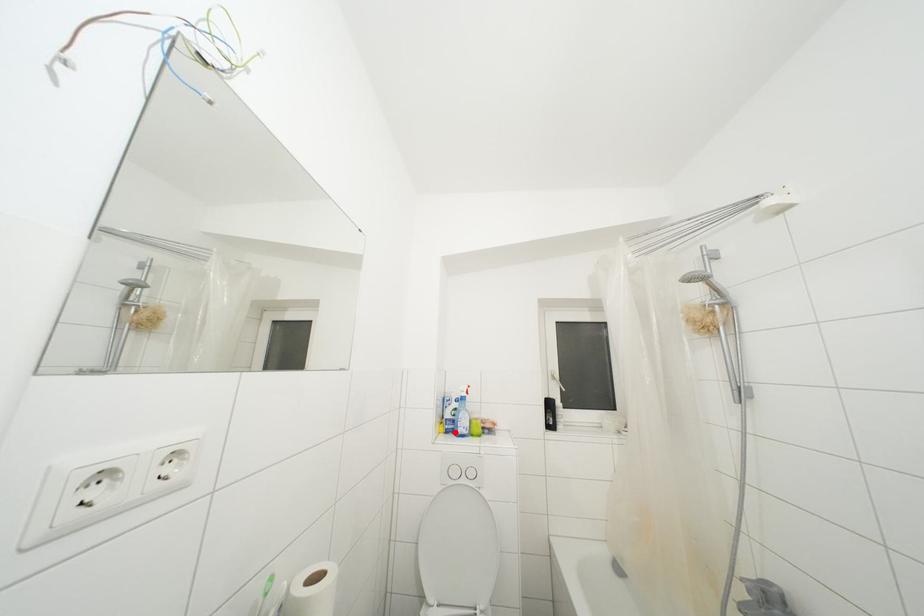
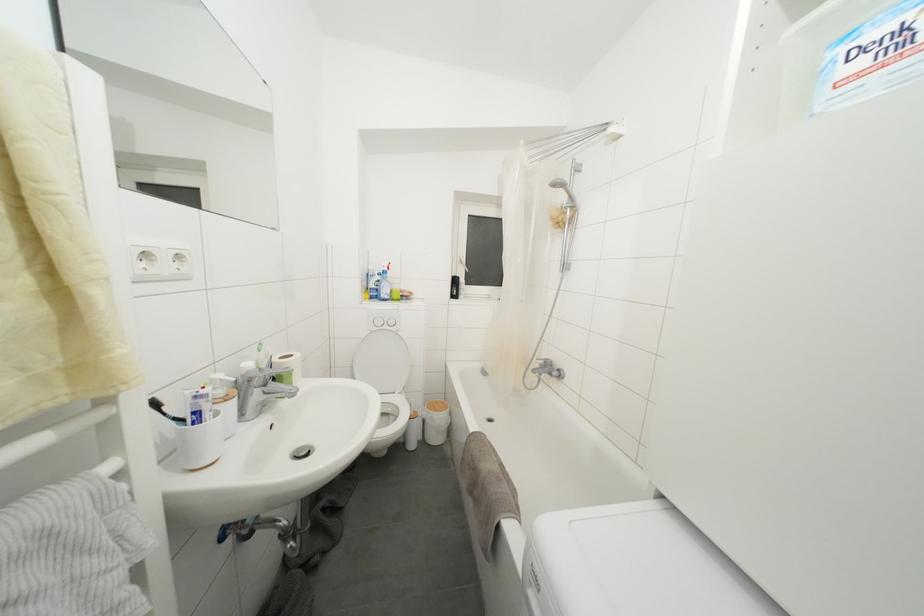
The point at the highlighted location is marked in the first image. Where is the corresponding point in the second image?

(379, 300)